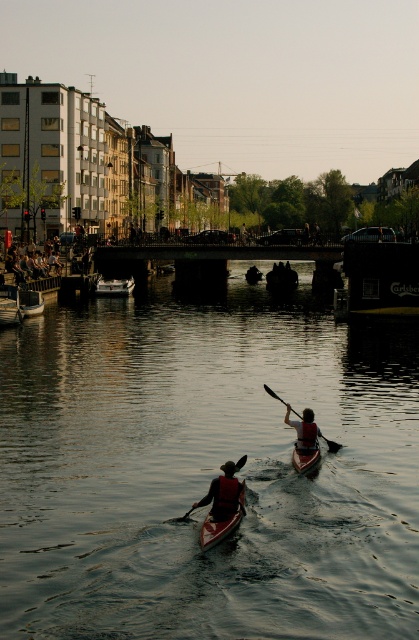
You are planning to transport a large sofa that requires a boat wider than the matte red canoe at center. Can the white plastic boat at center accommodate the sofa?

The white plastic boat at center is wider than the matte red canoe at center, so it can accommodate the sofa.

Consider the image. You are a safety inspector checking the placement of the dark red life vest at center and the wooden canoe at left. According to safety regulations, life vests must be easily accessible and not stored under any objects. Is the current placement compliant with safety standards?

The dark red life vest at center is positioned under the wooden canoe at left, which violates safety regulations as it is not easily accessible. The life vest should be stored in a visible and reachable location, not under any objects.

You are planning to store the orange plastic canoe at center and the red life jacket at center in a storage room. The storage room has a shelf that is 1.2 meters wide. Can both items be placed side by side on the shelf without exceeding its width?

The orange plastic canoe at center is wider than the red life jacket at center. Since the shelf is 1.2 meters wide, it depends on the combined width of both items. However, the description only states the canoe is wider, not their exact measurements. Without specific dimensions, it is impossible to determine if they fit together.